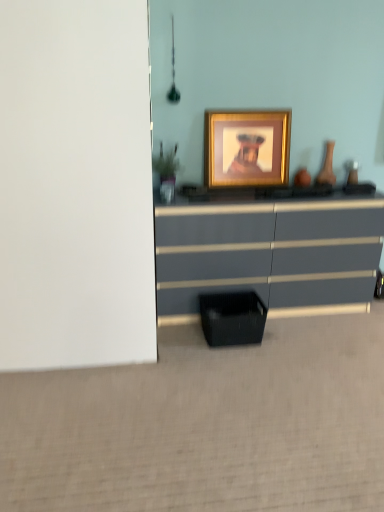
What do you see at coordinates (327, 167) in the screenshot? The height and width of the screenshot is (512, 384). I see `matte brown vase at right` at bounding box center [327, 167].

This screenshot has width=384, height=512. In order to click on green matte plant at left in this screenshot , I will do `click(166, 163)`.

From the image's perspective, is black mesh basket at lower center under green matte plant at left?

Yes.

Would you say black mesh basket at lower center is inside or outside green matte plant at left?

black mesh basket at lower center is not inside green matte plant at left, it's outside.

Is black mesh basket at lower center next to green matte plant at left and touching it?

No, black mesh basket at lower center is not next to green matte plant at left.

From the picture: Is matte gray chest of drawers at center placed right next to black mesh basket at lower center?

matte gray chest of drawers at center and black mesh basket at lower center are not in contact.

From a real-world perspective, who is located higher, matte gray chest of drawers at center or black mesh basket at lower center?

matte gray chest of drawers at center.

In the scene shown: In terms of width, does matte gray chest of drawers at center look wider or thinner when compared to black mesh basket at lower center?

In the image, matte gray chest of drawers at center appears to be wider than black mesh basket at lower center.

Measure the distance between matte gray chest of drawers at center and black mesh basket at lower center.

matte gray chest of drawers at center is 14.78 inches away from black mesh basket at lower center.

Considering the relative sizes of matte gray chest of drawers at center and gold/glossy picture frame at center in the image provided, is matte gray chest of drawers at center wider than gold/glossy picture frame at center?

Indeed, matte gray chest of drawers at center has a greater width compared to gold/glossy picture frame at center.

Can you tell me how much matte gray chest of drawers at center and gold/glossy picture frame at center differ in facing direction?

matte gray chest of drawers at center and gold/glossy picture frame at center are facing 0.104 degrees away from each other.

Is matte gray chest of drawers at center shorter than gold/glossy picture frame at center?

In fact, matte gray chest of drawers at center may be taller than gold/glossy picture frame at center.

Is point (234, 218) closer to camera compared to point (254, 162)?

Yes, point (234, 218) is closer to viewer.

Does point (222, 306) appear closer or farther from the camera than point (259, 182)?

Point (222, 306).

Does black mesh basket at lower center have a lesser width compared to gold/glossy picture frame at center?

No.

Who is taller, black mesh basket at lower center or gold/glossy picture frame at center?

Standing taller between the two is gold/glossy picture frame at center.

Does black mesh basket at lower center appear on the right side of gold/glossy picture frame at center?

No.

Is gold/glossy picture frame at center aimed at black mesh basket at lower center?

No, gold/glossy picture frame at center is not oriented towards black mesh basket at lower center.

Considering the points (240, 128) and (259, 310), which point is behind, point (240, 128) or point (259, 310)?

Point (240, 128)

Between gold/glossy picture frame at center and black mesh basket at lower center, which one has more height?

With more height is gold/glossy picture frame at center.

From a real-world perspective, which object stands above the other?

In real-world perspective, gold/glossy picture frame at center is above.

The width and height of the screenshot is (384, 512). In order to click on vase behind the matte gray chest of drawers at center in this screenshot , I will do `click(327, 167)`.

Is matte brown vase at right in front of matte gray chest of drawers at center?

No, matte brown vase at right is further to the viewer.

Considering the relative sizes of matte brown vase at right and matte gray chest of drawers at center in the image provided, is matte brown vase at right wider than matte gray chest of drawers at center?

Incorrect, the width of matte brown vase at right does not surpass that of matte gray chest of drawers at center.

Is matte brown vase at right facing away from matte gray chest of drawers at center?

No, matte brown vase at right's orientation is not away from matte gray chest of drawers at center.

Which of these two, green matte plant at left or matte brown vase at right, is wider?

With larger width is green matte plant at left.

Considering the sizes of green matte plant at left and matte brown vase at right in the image, is green matte plant at left bigger or smaller than matte brown vase at right?

In the image, green matte plant at left appears to be larger than matte brown vase at right.

Is green matte plant at left far from matte brown vase at right?

That's not correct — green matte plant at left is a little close to matte brown vase at right.

Does point (159, 172) lie behind point (318, 178)?

No, it is in front of (318, 178).

The height and width of the screenshot is (512, 384). Find the location of `cabinetry below the green matte plant at left (from a real-world perspective)`. cabinetry below the green matte plant at left (from a real-world perspective) is located at coordinates pos(232,318).

The height and width of the screenshot is (512, 384). In the image, there is a matte gray chest of drawers at center. In order to click on cabinetry below it (from the image's perspective) in this screenshot , I will do `click(232, 318)`.

In the scene shown: When comparing their distances from green matte plant at left, does black mesh basket at lower center or matte gray chest of drawers at center seem further?

black mesh basket at lower center is further to green matte plant at left.

Based on their spatial positions, is matte gray chest of drawers at center or gold/glossy picture frame at center further from green matte plant at left?

matte gray chest of drawers at center lies further to green matte plant at left than the other object.

From the image, which object appears to be farther from green matte plant at left, gold/glossy picture frame at center or black mesh basket at lower center?

The object further to green matte plant at left is black mesh basket at lower center.

From the image, which object appears to be farther from gold/glossy picture frame at center, matte gray chest of drawers at center or matte brown vase at right?

matte gray chest of drawers at center.

Based on their spatial positions, is green matte plant at left or black mesh basket at lower center further from matte gray chest of drawers at center?

The object further to matte gray chest of drawers at center is green matte plant at left.

Estimate the real-world distances between objects in this image. Which object is closer to black mesh basket at lower center, matte brown vase at right or matte gray chest of drawers at center?

Based on the image, matte gray chest of drawers at center appears to be nearer to black mesh basket at lower center.

Considering their positions, is matte brown vase at right positioned closer to matte gray chest of drawers at center than green matte plant at left?

The object closer to matte gray chest of drawers at center is matte brown vase at right.

Based on their spatial positions, is matte brown vase at right or gold/glossy picture frame at center closer to matte gray chest of drawers at center?

Among the two, gold/glossy picture frame at center is located nearer to matte gray chest of drawers at center.

I want to click on chest of drawers between green matte plant at left and matte brown vase at right, so click(x=268, y=253).

Locate an element on the screen. vase between gold/glossy picture frame at center and matte gray chest of drawers at center in the vertical direction is located at coordinates (327, 167).

Find the location of a particular element. picture frame between green matte plant at left and matte brown vase at right is located at coordinates (247, 148).

Image resolution: width=384 pixels, height=512 pixels. Identify the location of vase between gold/glossy picture frame at center and black mesh basket at lower center in the up-down direction. (327, 167).